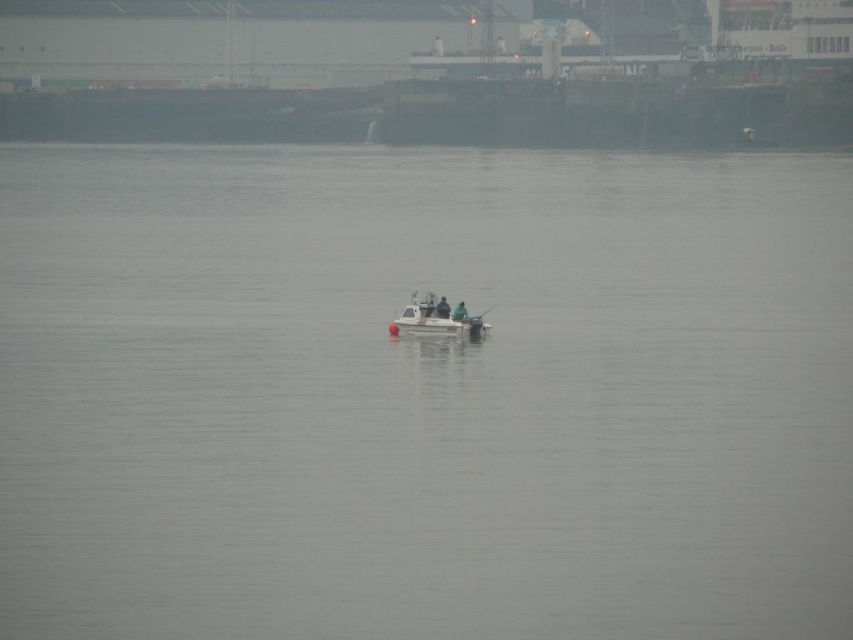
Which is above, white plastic boat at center or dark blue fabric jacket at center?

dark blue fabric jacket at center is higher up.

Can you confirm if white plastic boat at center is wider than dark blue fabric jacket at center?

Correct, the width of white plastic boat at center exceeds that of dark blue fabric jacket at center.

In order to click on white plastic boat at center in this screenshot , I will do `click(436, 317)`.

Locate an element on the screen. The height and width of the screenshot is (640, 853). white plastic boat at center is located at coordinates (436, 317).

Between dark blue fabric jacket at center and green matte jacket at center, which one has less height?

With less height is green matte jacket at center.

Looking at this image, how far apart are dark blue fabric jacket at center and green matte jacket at center?

They are 3.50 feet apart.

What are the coordinates of `dark blue fabric jacket at center` in the screenshot? It's located at (442, 308).

Can you confirm if white plastic boat at center is taller than green matte jacket at center?

Indeed, white plastic boat at center has a greater height compared to green matte jacket at center.

Which is behind, point (431, 292) or point (463, 317)?

The point (431, 292) is behind.

Does point (439, 333) lie in front of point (462, 316)?

Yes, point (439, 333) is closer to viewer.

I want to click on white plastic boat at center, so click(436, 317).